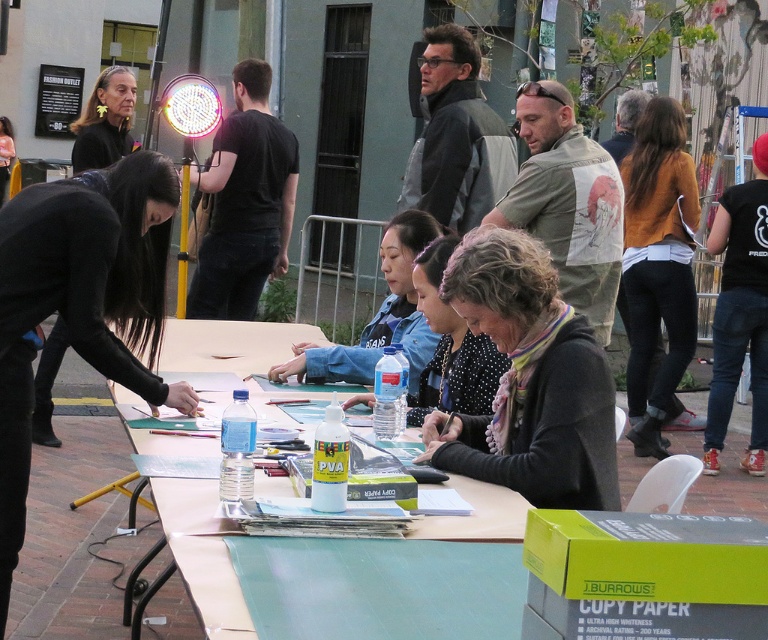
Which is more to the right, black matte hair at left or polka dot blouse at center?

polka dot blouse at center is more to the right.

Does black matte hair at left appear on the right side of polka dot blouse at center?

Incorrect, black matte hair at left is not on the right side of polka dot blouse at center.

The image size is (768, 640). I want to click on black matte hair at left, so click(80, 304).

Locate an element on the screen. Image resolution: width=768 pixels, height=640 pixels. black matte hair at left is located at coordinates (80, 304).

Is black matte hair at left positioned behind denim jacket at center?

No, it is in front of denim jacket at center.

Who is more forward, [68,204] or [326,349]?

Positioned in front is point [68,204].

Locate an element on the screen. black matte hair at left is located at coordinates (80, 304).

Is denim jacket at center positioned behind matte black hair at upper left?

No, denim jacket at center is closer to the viewer.

At what (x,y) coordinates should I click in order to perform the action: click on denim jacket at center. Please return your answer as a coordinate pair (x, y). The height and width of the screenshot is (640, 768). Looking at the image, I should click on (376, 316).

Is point (343, 353) behind point (108, 72)?

No, it is not.

Find the location of a particular element. The width and height of the screenshot is (768, 640). denim jacket at center is located at coordinates (376, 316).